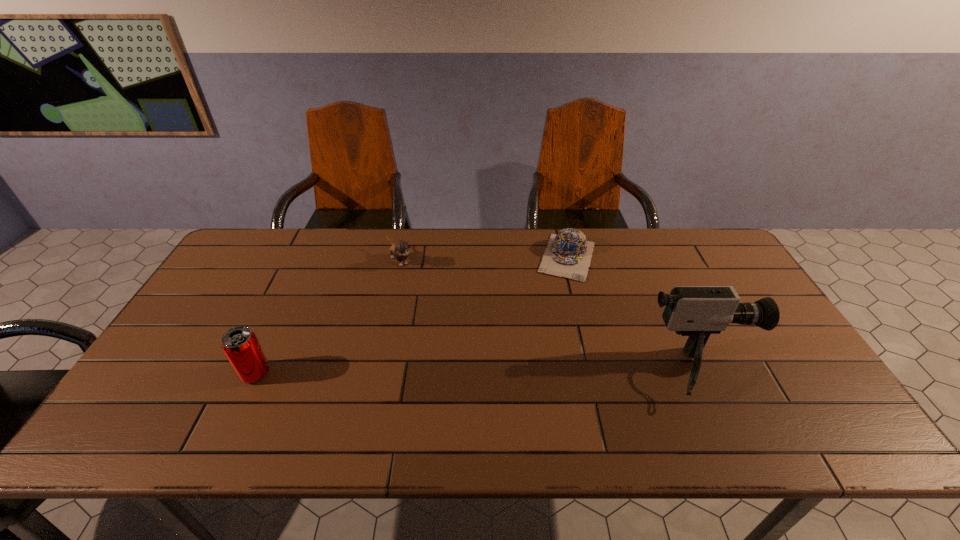
At what (x,y) coordinates should I click in order to perform the action: click on object that is at the right edge. Please return your answer as a coordinate pair (x, y). The width and height of the screenshot is (960, 540). Looking at the image, I should click on (696, 311).

The width and height of the screenshot is (960, 540). I want to click on object at the near right corner, so point(696,311).

Find the location of `vacant space at the far edge of the desktop`. vacant space at the far edge of the desktop is located at coordinates (359, 246).

Image resolution: width=960 pixels, height=540 pixels. What are the coordinates of `vacant space at the near edge of the desktop` in the screenshot? It's located at (269, 381).

Locate an element on the screen. The image size is (960, 540). free space at the left edge of the desktop is located at coordinates (234, 305).

At what (x,y) coordinates should I click in order to perform the action: click on vacant space at the right edge of the desktop. Please return your answer as a coordinate pair (x, y). This screenshot has width=960, height=540. Looking at the image, I should click on (744, 283).

Locate an element on the screen. vacant space at the far left corner of the desktop is located at coordinates (286, 237).

In the image, there is a desktop. Where is `vacant space at the near left corner`? Image resolution: width=960 pixels, height=540 pixels. vacant space at the near left corner is located at coordinates (166, 411).

The image size is (960, 540). In the image, there is a desktop. Identify the location of free space at the far right corner. (725, 252).

Locate an element on the screen. This screenshot has height=540, width=960. free space at the near right corner of the desktop is located at coordinates (816, 393).